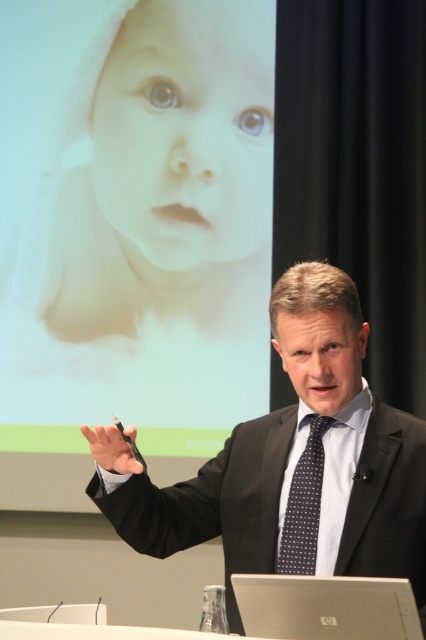
Does smooth white baby at upper left have a lesser height compared to silver metallic laptop at lower center?

Incorrect, smooth white baby at upper left's height does not fall short of silver metallic laptop at lower center's.

Describe the element at coordinates (134, 160) in the screenshot. I see `smooth white baby at upper left` at that location.

Identify the location of smooth white baby at upper left. (134, 160).

Who is lower down, silver metallic laptop at lower center or dark blue dotted tie at center?

silver metallic laptop at lower center is below.

Which is in front, point (302, 614) or point (302, 499)?

Point (302, 614) is in front.

Find the location of a particular element. silver metallic laptop at lower center is located at coordinates (325, 608).

Between black suit at center and dark blue dotted tie at center, which one appears on the right side from the viewer's perspective?

dark blue dotted tie at center

Describe the element at coordinates (291, 464) in the screenshot. I see `black suit at center` at that location.

Image resolution: width=426 pixels, height=640 pixels. In order to click on black suit at center in this screenshot , I will do `click(291, 464)`.